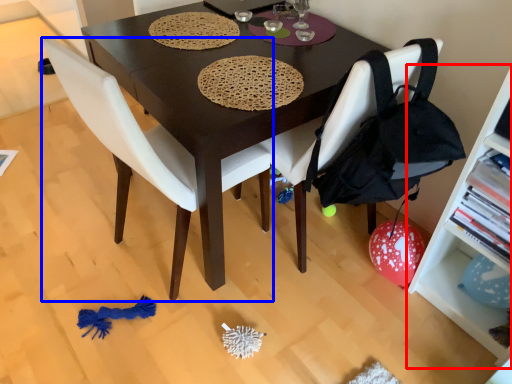
Question: Among these objects, which one is farthest to the camera, shelf (highlighted by a red box) or chair (highlighted by a blue box)?

Choices:
 (A) shelf
 (B) chair

Answer: (B)